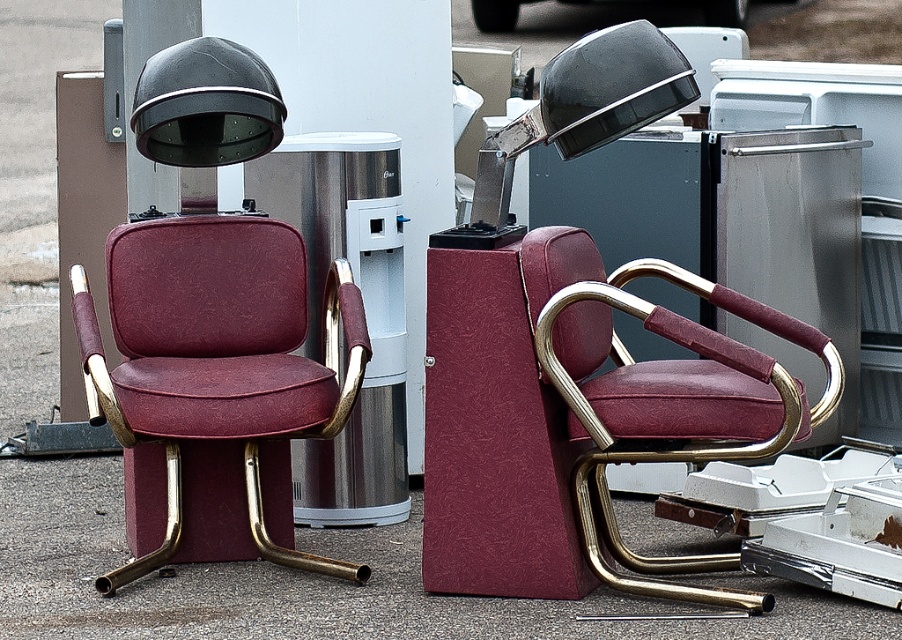
Question: Where is maroon leather swivel chair at center located in relation to black glossy hairdryer at upper center in the image?

Choices:
 (A) below
 (B) above

Answer: (A)

Question: Which point appears closest to the camera in this image?

Choices:
 (A) (605, 294)
 (B) (91, 339)
 (C) (233, 100)

Answer: (A)

Question: Which point is closer to the camera?

Choices:
 (A) (192, 112)
 (B) (726, 564)

Answer: (A)

Question: Is maroon leather swivel chair at left wider than black glossy hairdryer at upper center?

Choices:
 (A) yes
 (B) no

Answer: (A)

Question: Which point is closer to the camera taking this photo?

Choices:
 (A) click(275, 308)
 (B) click(130, 118)

Answer: (B)

Question: Is maroon leather swivel chair at left thinner than black glossy hairdryer at upper center?

Choices:
 (A) no
 (B) yes

Answer: (A)